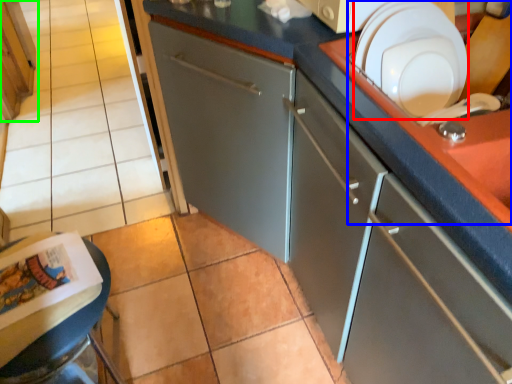
Question: Which object is positioned farthest from tableware (highlighted by a red box)? Select from sink (highlighted by a blue box) and cabinetry (highlighted by a green box).

Choices:
 (A) sink
 (B) cabinetry

Answer: (B)